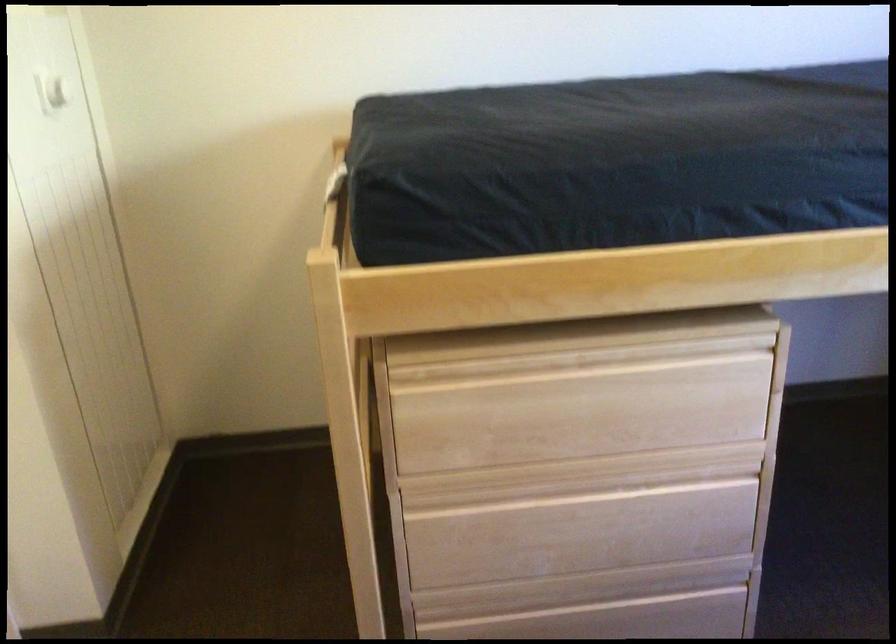
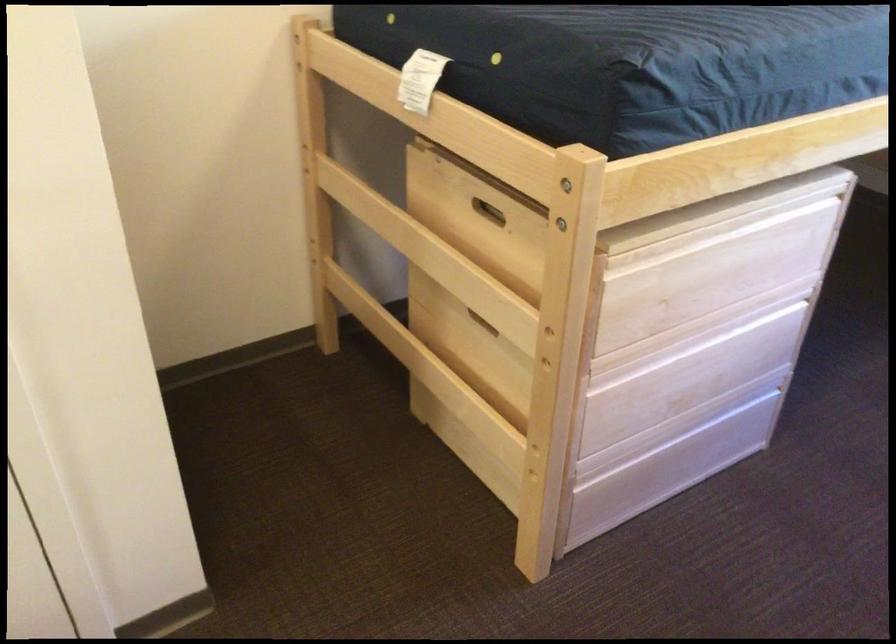
Question: What movement of the cameraman would produce the second image?

Choices:
 (A) Left
 (B) Right
 (C) Forward
 (D) Backward

Answer: (A)